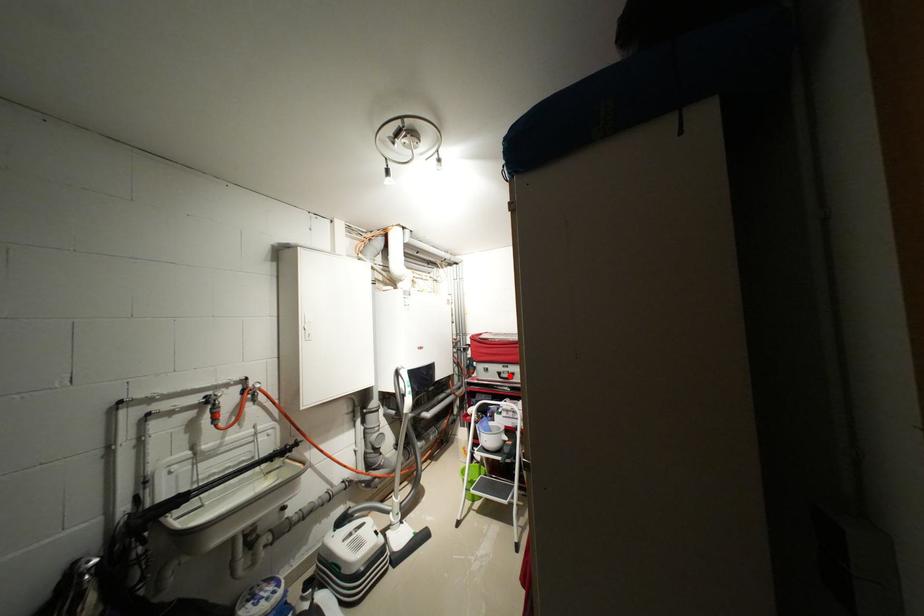
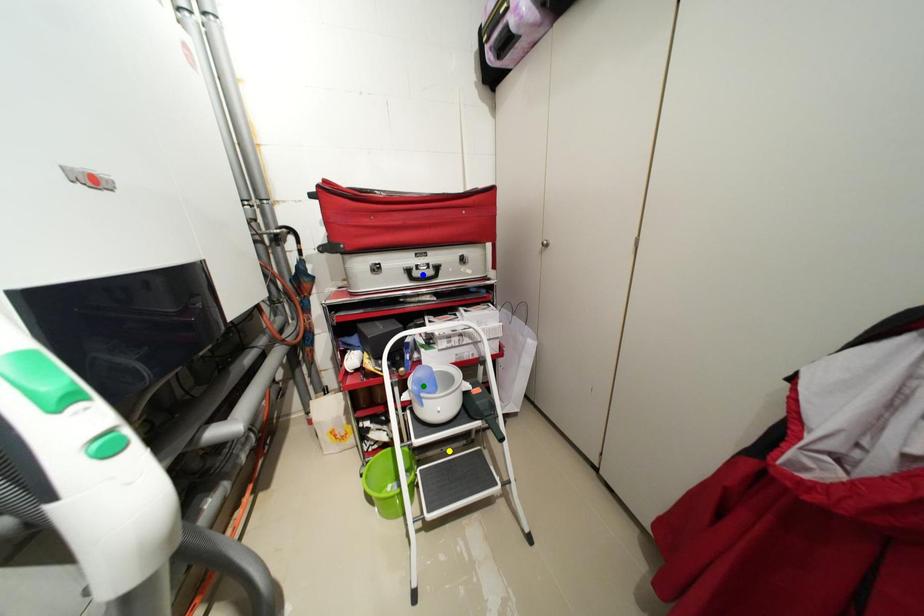
Question: I am providing you with two images of the same scene from different viewpoints. A red point is marked on the first image. You are given multiple points on the second image. Can you choose the point in image 2 that corresponds to the point in image 1?

Choices:
 (A) yellow point
 (B) blue point
 (C) green point

Answer: (B)